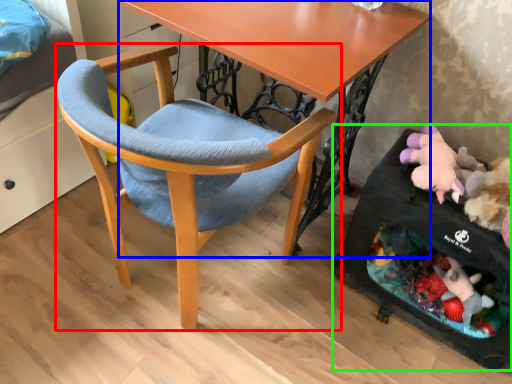
Question: Which is farther away from chair (highlighted by a red box)? desk (highlighted by a blue box) or baby carriage (highlighted by a green box)?

Choices:
 (A) desk
 (B) baby carriage

Answer: (B)